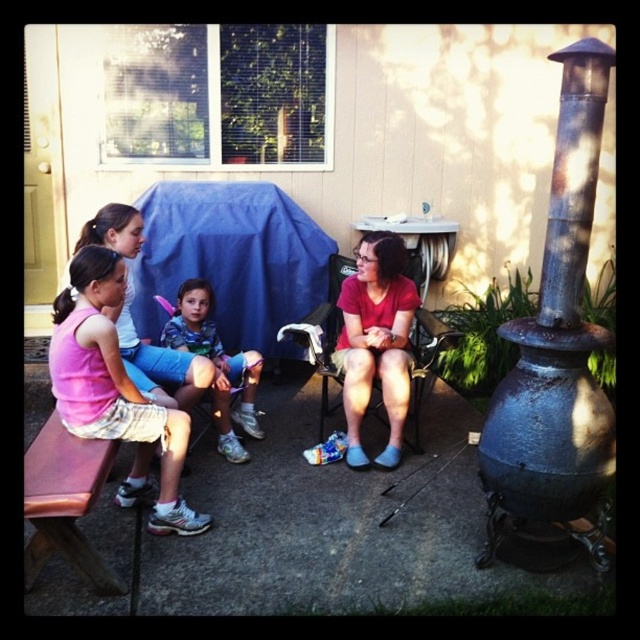
Question: From the image, what is the correct spatial relationship of rusty metal chimney at right in relation to matte red shirt at center?

Choices:
 (A) below
 (B) above

Answer: (B)

Question: Which object is the farthest from the matte red shirt at center?

Choices:
 (A) rusty metal chimney at right
 (B) blue denim shorts at center
 (C) pink fabric shorts at left
 (D) brown wooden bench at lower left

Answer: (D)

Question: Which object appears closest to the camera in this image?

Choices:
 (A) pink fabric shorts at left
 (B) rusty metal chimney at right
 (C) brown wooden bench at lower left

Answer: (C)

Question: Is rusty metal chimney at right positioned behind brown wooden bench at lower left?

Choices:
 (A) yes
 (B) no

Answer: (A)

Question: Which point is farther to the camera?

Choices:
 (A) matte red shirt at center
 (B) brown wooden bench at lower left
 (C) pink fabric shorts at left
 (D) blue denim shorts at center

Answer: (A)

Question: Can you confirm if matte red shirt at center is positioned to the left of blue denim shorts at center?

Choices:
 (A) no
 (B) yes

Answer: (A)